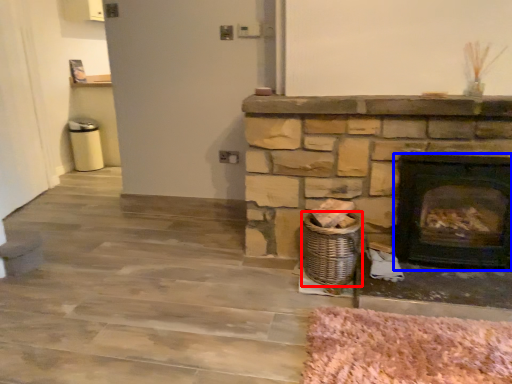
Question: Which object appears closest to the camera in this image, basket (highlighted by a red box) or wood burning stove (highlighted by a blue box)?

Choices:
 (A) basket
 (B) wood burning stove

Answer: (B)